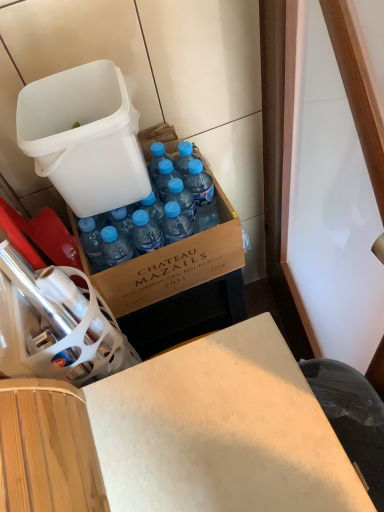
Question: Considering the relative sizes of white plastic trash can at upper left and blue plastic bottle at center in the image provided, is white plastic trash can at upper left taller than blue plastic bottle at center?

Choices:
 (A) no
 (B) yes

Answer: (A)

Question: Is white plastic trash can at upper left outside blue plastic bottle at center?

Choices:
 (A) yes
 (B) no

Answer: (A)

Question: Is white plastic trash can at upper left to the right of blue plastic bottle at center from the viewer's perspective?

Choices:
 (A) no
 (B) yes

Answer: (A)

Question: Considering the relative sizes of white plastic trash can at upper left and blue plastic bottle at center in the image provided, is white plastic trash can at upper left bigger than blue plastic bottle at center?

Choices:
 (A) yes
 (B) no

Answer: (A)

Question: Is white plastic trash can at upper left next to blue plastic bottle at center and touching it?

Choices:
 (A) yes
 (B) no

Answer: (B)

Question: Is point (206, 189) positioned closer to the camera than point (86, 182)?

Choices:
 (A) closer
 (B) farther

Answer: (B)

Question: In terms of width, does blue plastic bottle at center look wider or thinner when compared to white plastic trash can at upper left?

Choices:
 (A) thin
 (B) wide

Answer: (A)

Question: Is blue plastic bottle at center bigger or smaller than white plastic trash can at upper left?

Choices:
 (A) big
 (B) small

Answer: (B)

Question: Is blue plastic bottle at center to the left or to the right of white plastic trash can at upper left in the image?

Choices:
 (A) left
 (B) right

Answer: (B)

Question: Is wooden desk at center to the left or to the right of white plastic trash can at upper left in the image?

Choices:
 (A) left
 (B) right

Answer: (B)

Question: From the image's perspective, is wooden desk at center positioned above or below white plastic trash can at upper left?

Choices:
 (A) above
 (B) below

Answer: (B)

Question: In terms of height, does wooden desk at center look taller or shorter compared to white plastic trash can at upper left?

Choices:
 (A) short
 (B) tall

Answer: (B)

Question: From a real-world perspective, is wooden desk at center physically located above or below white plastic trash can at upper left?

Choices:
 (A) below
 (B) above

Answer: (A)

Question: From the image's perspective, relative to blue plastic bottle at center, is wooden desk at center above or below?

Choices:
 (A) above
 (B) below

Answer: (B)

Question: Looking at their shapes, would you say wooden desk at center is wider or thinner than blue plastic bottle at center?

Choices:
 (A) wide
 (B) thin

Answer: (A)